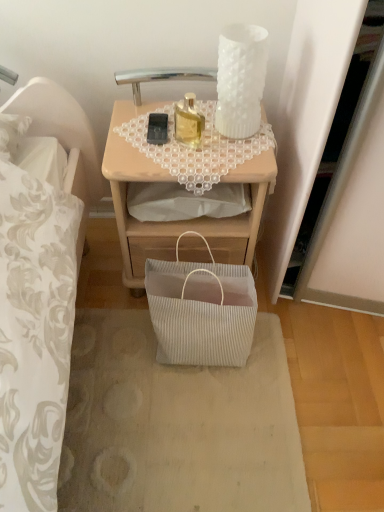
At what (x,y) coordinates should I click in order to perform the action: click on vacant space to the right of translucent glass bottle at center. Please return your answer as a coordinate pair (x, y). The width and height of the screenshot is (384, 512). Looking at the image, I should click on (237, 144).